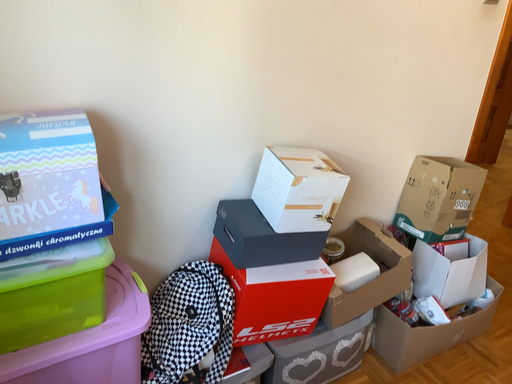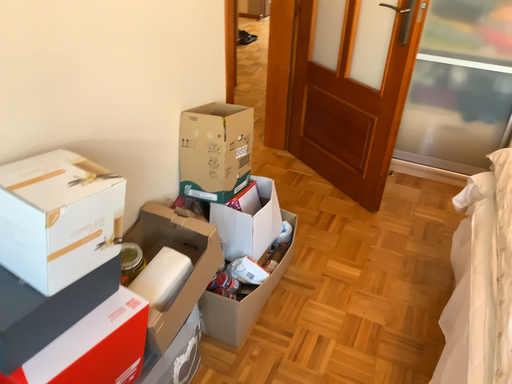
Question: Which way did the camera rotate in the video?

Choices:
 (A) rotated left
 (B) rotated right

Answer: (B)